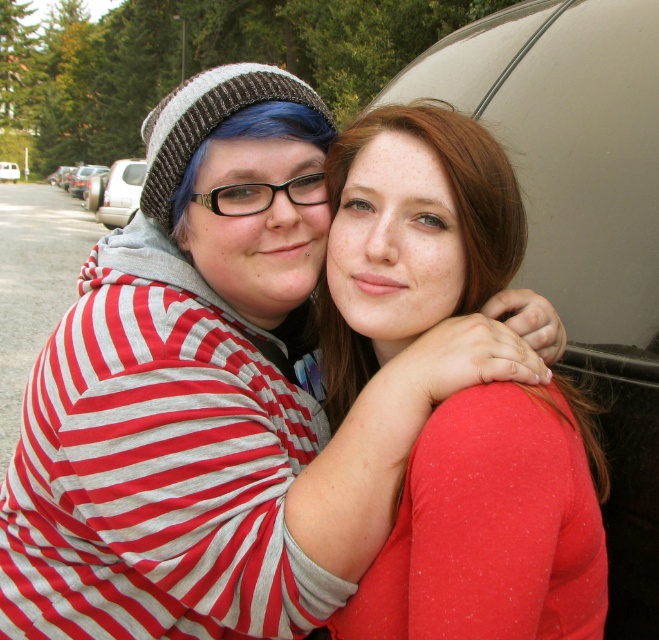
Question: Which point is closer to the camera?

Choices:
 (A) silver metallic car at left
 (B) matte red sweater at center
 (C) metallic silver car at center

Answer: (B)

Question: Which of these objects is positioned farthest from the metallic silver car at center?

Choices:
 (A) silver metallic car at left
 (B) matte red sweater at center

Answer: (B)

Question: Does matte red sweater at center have a lesser width compared to metallic silver car at center?

Choices:
 (A) yes
 (B) no

Answer: (A)

Question: Does silver metallic car at left have a larger size compared to metallic silver car at center?

Choices:
 (A) no
 (B) yes

Answer: (B)

Question: Can you confirm if matte red sweater at center is positioned above silver metallic car at left?

Choices:
 (A) no
 (B) yes

Answer: (A)

Question: Which is nearer to the metallic silver car at center?

Choices:
 (A) matte red sweater at center
 (B) silver metallic car at left

Answer: (B)